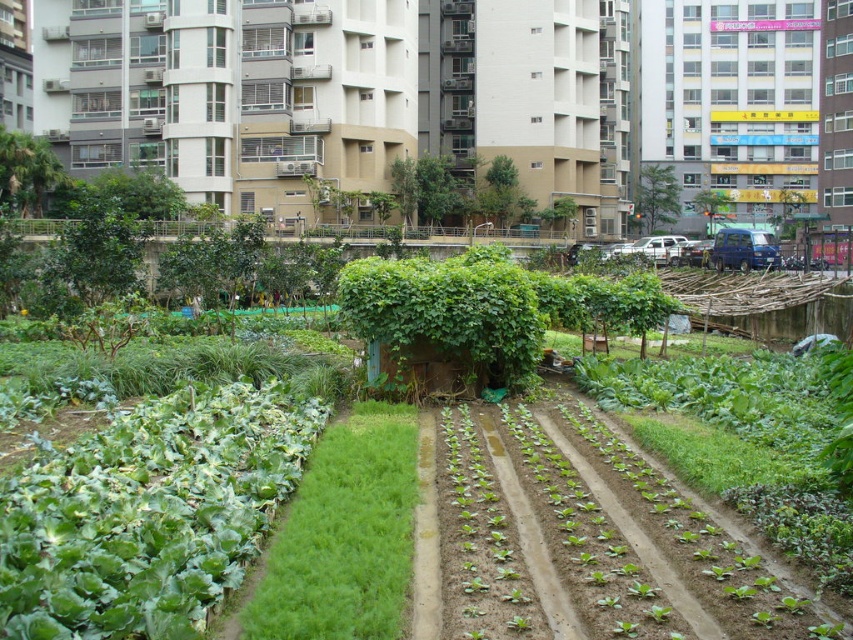
You are standing in the community garden and want to take a photo of both the leafy greens on the left and the seedlings on the right. You notice two points marked in the image at coordinates point (186, 401) and point (306, 467). Which point should you stand closer to ensure both areas are in focus?

You should stand closer to point (306, 467) because point (186, 401) is further away from the camera. By positioning yourself near the closer point, you can better capture both the leafy greens on the left and the seedlings on the right in focus.

You are a gardener looking at the community garden. You see the green leafy vegetables at center and the green leafy grass at center. Which one is positioned lower in the image?

The green leafy vegetables at center is located below green leafy grass at center, so it is positioned lower in the image.

You are a gardener who wants to plant a new flower that requires a spot with more sunlight. You notice the green leafy vegetables at center and the green leafy grass at center. Which area would you choose for planting the flower?

The green leafy grass at center is taller than the green leafy vegetables at center, so planting the flower in the area with the green leafy vegetables at center would provide more sunlight since they are shorter.